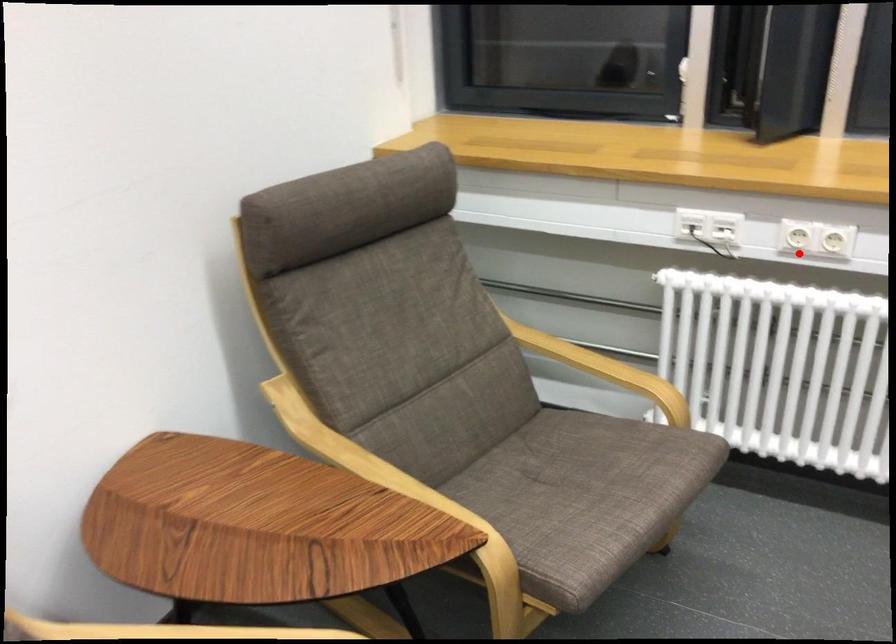
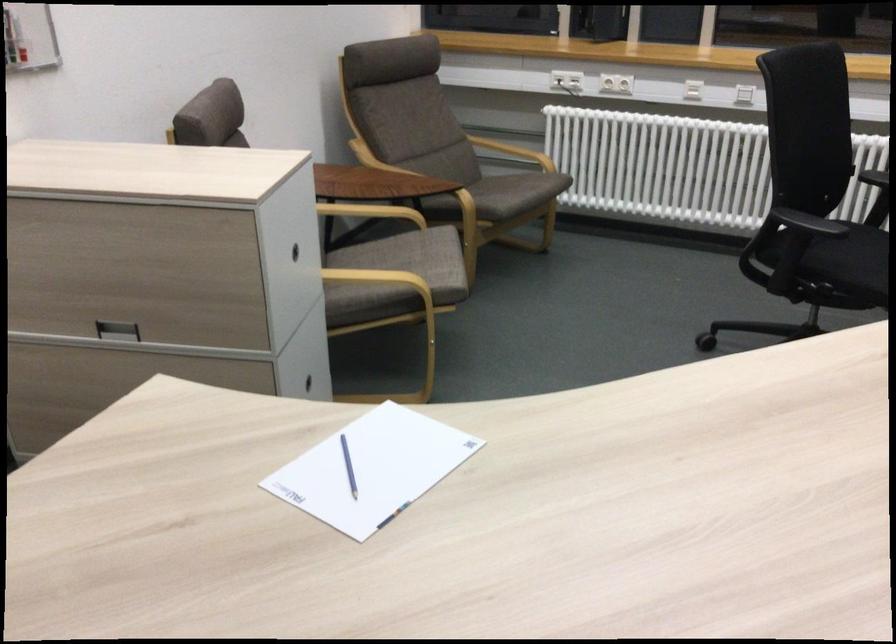
The point at the highlighted location is marked in the first image. Where is the corresponding point in the second image?

(616, 82)